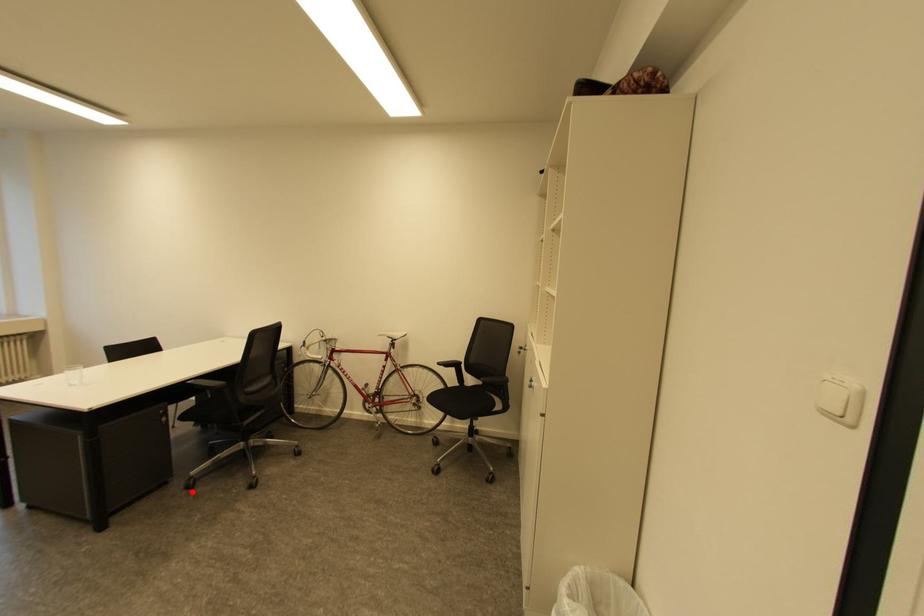
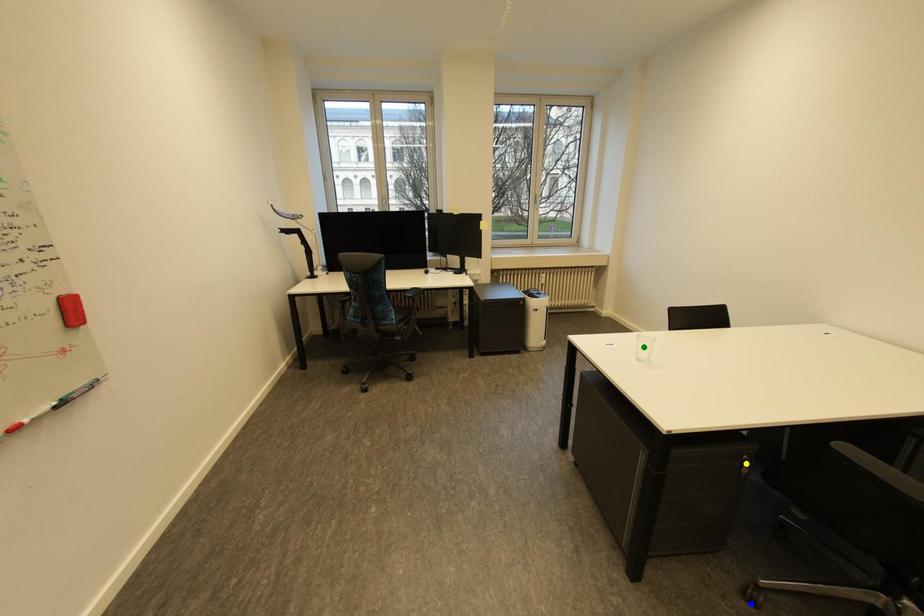
Question: I am providing you with two images of the same scene from different viewpoints. A red point is marked on the first image. You are given multiple points on the second image. Can you choose the point in image 2 that corresponds to the point in image 1?

Choices:
 (A) yellow point
 (B) blue point
 (C) green point

Answer: (B)